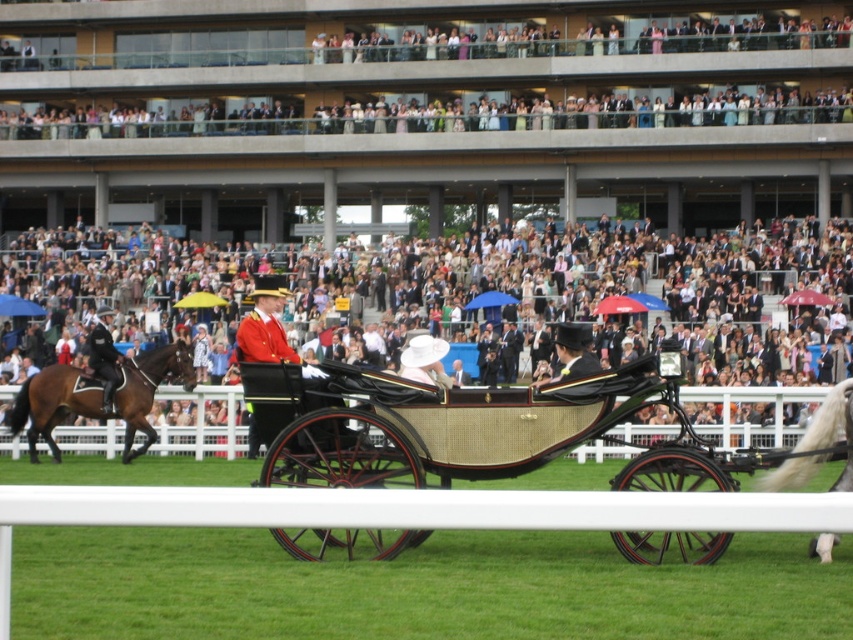
You are a photographer at the event and want to capture a photo of both the brown glossy horse at left and the white silky horse at right. Since you can only focus on one horse at a time, which horse should you focus on first to ensure the other is still in the frame?

The brown glossy horse at left is positioned under the white silky horse at right, so focusing on the brown glossy horse at left first would keep the white silky horse at right in the frame.

You are a photographer trying to capture a clear photo of the white silky horse at right without the light beige fabric crowd at center blocking the view. Based on their heights, can you position yourself in a way that the horse is fully visible above the crowd?

The light beige fabric crowd at center has a greater height compared to white silky horse at right, so positioning yourself to have the horse fully visible above the crowd might not be possible since the crowd is taller than the horse.